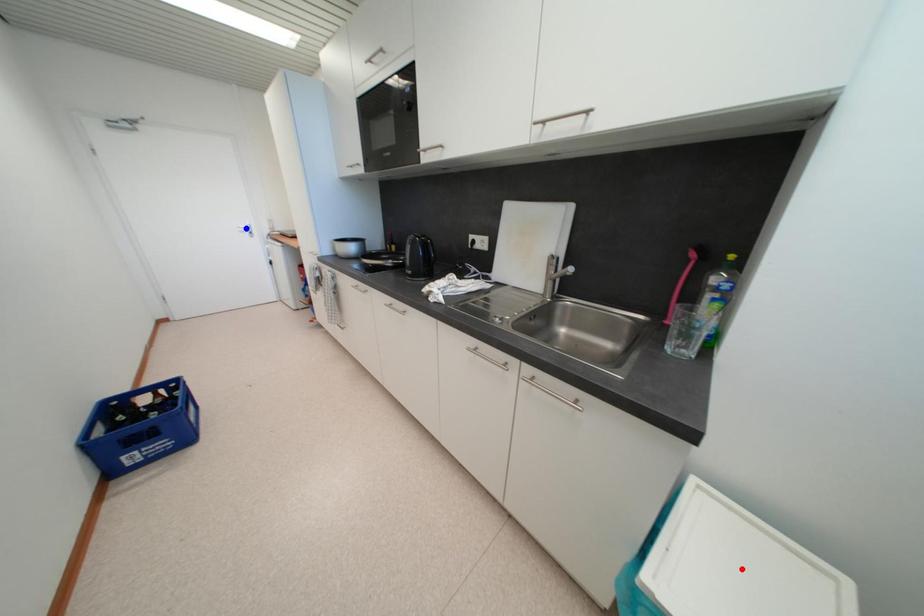
Question: Which of the two points in the image is closer to the camera?

Choices:
 (A) Blue point is closer.
 (B) Red point is closer.

Answer: (B)